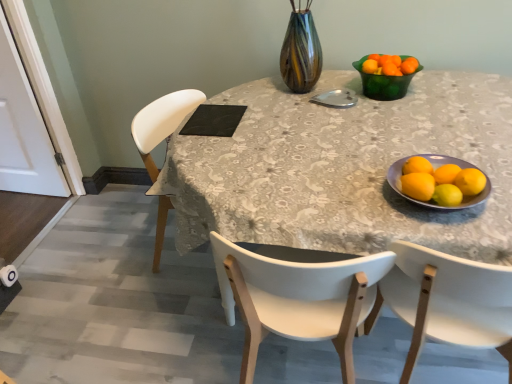
Identify the location of free space behind yellow matte lemon at right, positioned as the fourth lemon in right-to-left order. This screenshot has width=512, height=384. (412, 170).